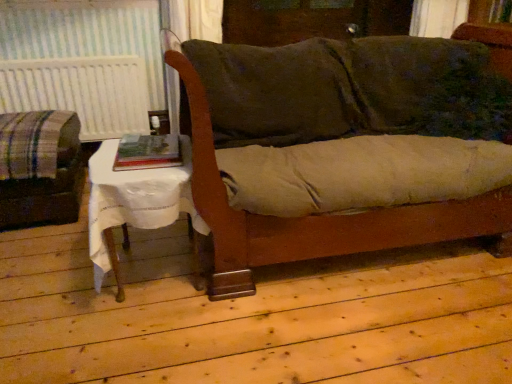
Question: From a real-world perspective, is velvet green couch at center on top of hardcover book at center?

Choices:
 (A) yes
 (B) no

Answer: (B)

Question: Is velvet green couch at center not inside hardcover book at center?

Choices:
 (A) yes
 (B) no

Answer: (A)

Question: Is velvet green couch at center behind hardcover book at center?

Choices:
 (A) yes
 (B) no

Answer: (B)

Question: Does velvet green couch at center have a lesser width compared to hardcover book at center?

Choices:
 (A) no
 (B) yes

Answer: (A)

Question: From the image's perspective, is velvet green couch at center above hardcover book at center?

Choices:
 (A) yes
 (B) no

Answer: (A)

Question: Could you tell me if velvet green couch at center is turned towards hardcover book at center?

Choices:
 (A) no
 (B) yes

Answer: (A)

Question: Does white cloth-covered table at lower left have a greater width compared to white textured radiator at left?

Choices:
 (A) no
 (B) yes

Answer: (B)

Question: Is white cloth-covered table at lower left in front of white textured radiator at left?

Choices:
 (A) no
 (B) yes

Answer: (B)

Question: Is white cloth-covered table at lower left behind white textured radiator at left?

Choices:
 (A) yes
 (B) no

Answer: (B)

Question: Would you consider white cloth-covered table at lower left to be distant from white textured radiator at left?

Choices:
 (A) yes
 (B) no

Answer: (A)

Question: Is white cloth-covered table at lower left to the right of white textured radiator at left from the viewer's perspective?

Choices:
 (A) yes
 (B) no

Answer: (A)

Question: Is white cloth-covered table at lower left positioned with its back to white textured radiator at left?

Choices:
 (A) yes
 (B) no

Answer: (A)

Question: Is white cloth-covered table at lower left in front of velvet green couch at center?

Choices:
 (A) yes
 (B) no

Answer: (B)